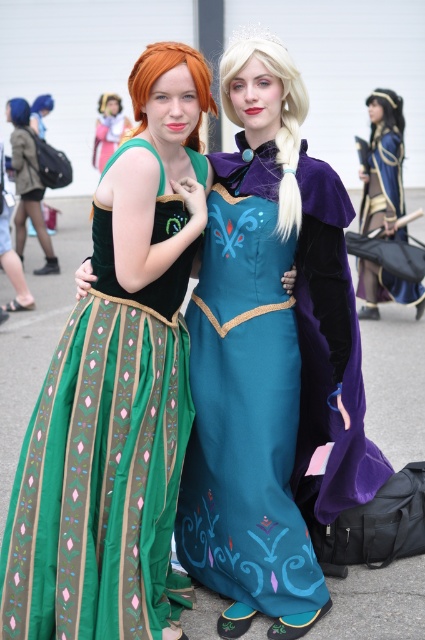
Between point (170, 317) and point (105, 132), which one is positioned in front?

Point (170, 317)

Who is shorter, green satin dress at left or matte green dress at center?

matte green dress at center

Is point (169, 300) more distant than point (118, 97)?

No, (169, 300) is in front of (118, 97).

Where is `green satin dress at left`? The height and width of the screenshot is (640, 425). green satin dress at left is located at coordinates (102, 465).

Can you confirm if teal satin dress at center is bigger than green satin dress at left?

Correct, teal satin dress at center is larger in size than green satin dress at left.

Does teal satin dress at center appear under green satin dress at left?

Actually, teal satin dress at center is above green satin dress at left.

Does point (218, 378) come behind point (96, 602)?

That is True.

Locate an element on the screen. The image size is (425, 640). teal satin dress at center is located at coordinates (271, 387).

Is green satin dress at left positioned before velvet blue cape at center?

Yes, it is.

Between green satin dress at left and velvet blue cape at center, which one is positioned lower?

green satin dress at left is below.

Who is more forward, (113, 547) or (377, 266)?

Point (113, 547)

This screenshot has height=640, width=425. I want to click on green satin dress at left, so click(102, 465).